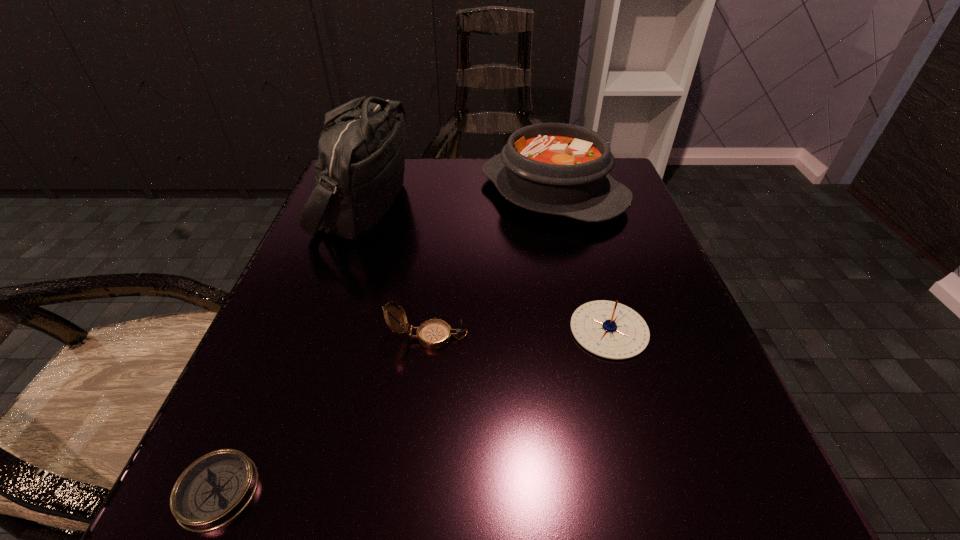
What are the coordinates of `vacant area between the rightmost compass and the tallest object` in the screenshot? It's located at (487, 267).

Image resolution: width=960 pixels, height=540 pixels. What are the coordinates of `free spot between the rightmost compass and the leftmost compass` in the screenshot? It's located at [414, 410].

Identify the location of vacant space that is in between the fourth shortest object and the nearest object. The width and height of the screenshot is (960, 540). (385, 341).

This screenshot has width=960, height=540. Find the location of `empty space between the tallest object and the shortest compass`. empty space between the tallest object and the shortest compass is located at coordinates (291, 348).

You are a GUI agent. You are given a task and a screenshot of the screen. Output one action in this format:
    pyautogui.click(x=<x>, y=<y>)
    Task: Click on the unoccupied area between the rightmost compass and the second compass from left to right
    Image resolution: width=960 pixels, height=540 pixels.
    Given the screenshot: What is the action you would take?
    click(x=518, y=333)

You are a GUI agent. You are given a task and a screenshot of the screen. Output one action in this format:
    pyautogui.click(x=<x>, y=<y>)
    Task: Click on the vacant area that lies between the shoulder bag and the rightmost compass
    
    Given the screenshot: What is the action you would take?
    pyautogui.click(x=487, y=267)

Image resolution: width=960 pixels, height=540 pixels. I want to click on object that ranks as the second closest to the shortest compass, so click(360, 169).

At what (x,y) coordinates should I click in order to perform the action: click on object that ranks as the closest to the nearest compass. Please return your answer as a coordinate pair (x, y). The width and height of the screenshot is (960, 540). Looking at the image, I should click on (433, 334).

Where is `compass that is the second closest to the rightmost compass`? Image resolution: width=960 pixels, height=540 pixels. compass that is the second closest to the rightmost compass is located at coordinates (216, 488).

What are the coordinates of `compass identified as the closest to the shoulder bag` in the screenshot? It's located at [x=433, y=334].